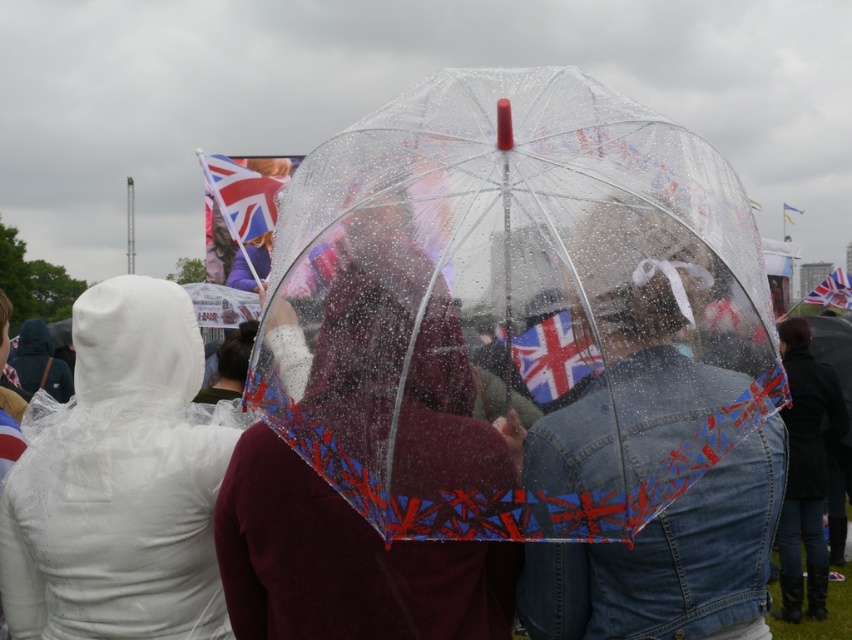
Question: Can you confirm if white translucent raincoat at left is wider than union jack fabric flag at upper center?

Choices:
 (A) yes
 (B) no

Answer: (B)

Question: Which of the following is the closest to the observer?

Choices:
 (A) (308, 284)
 (B) (593, 627)
 (C) (144, 435)

Answer: (A)

Question: Which of the following is the farthest from the observer?

Choices:
 (A) denim jacket at center
 (B) jeans at lower right
 (C) union jack fabric flag at center

Answer: (B)

Question: Considering the relative positions of transparent plastic umbrella at center and union jack flag at upper center in the image provided, where is transparent plastic umbrella at center located with respect to union jack flag at upper center?

Choices:
 (A) left
 (B) right

Answer: (A)

Question: Which point is closer to the camera?

Choices:
 (A) jeans at lower right
 (B) union jack flag at upper center
 (C) union jack fabric flag at center
 (D) white translucent raincoat at left

Answer: (C)

Question: Does white translucent raincoat at left appear on the left side of union jack flag at upper center?

Choices:
 (A) no
 (B) yes

Answer: (B)